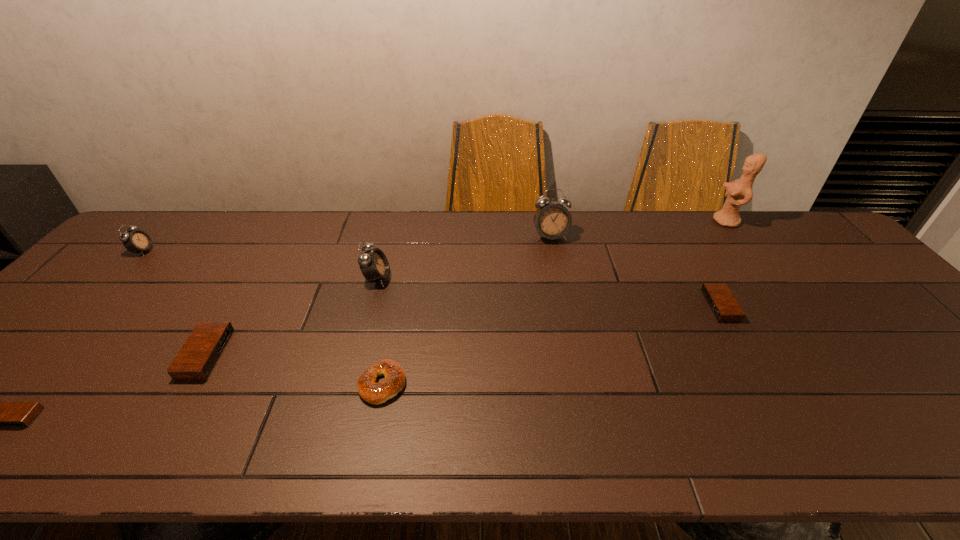
Identify the location of bagel. The image size is (960, 540). (375, 393).

In order to click on the fifth farthest object in this screenshot , I will do `click(722, 303)`.

I want to click on the second smallest black alarm clock, so click(x=722, y=303).

This screenshot has width=960, height=540. I want to click on free location located 0.280m on the front-facing side of the tallest object, so click(630, 221).

You are a GUI agent. You are given a task and a screenshot of the screen. Output one action in this format:
    pyautogui.click(x=<x>, y=<y>)
    Task: Click on the blank space located on the front-facing side of the tallest object
    Image resolution: width=960 pixels, height=540 pixels.
    Given the screenshot: What is the action you would take?
    pyautogui.click(x=689, y=221)

This screenshot has height=540, width=960. I want to click on vacant space situated 0.080m on the front-facing side of the tallest object, so click(x=689, y=221).

At what (x,y) coordinates should I click in order to perform the action: click on free space located on the face of the biggest white alarm clock. Please return your answer as a coordinate pair (x, y). The width and height of the screenshot is (960, 540). Looking at the image, I should click on (572, 341).

Where is `free space located 0.200m on the face of the fourth nearest alarm clock`? free space located 0.200m on the face of the fourth nearest alarm clock is located at coordinates (461, 279).

The width and height of the screenshot is (960, 540). I want to click on free space located 0.110m on the face of the smallest white alarm clock, so click(188, 251).

The height and width of the screenshot is (540, 960). Identify the location of vacant area situated 0.310m on the front face of the biggest black alarm clock. (353, 355).